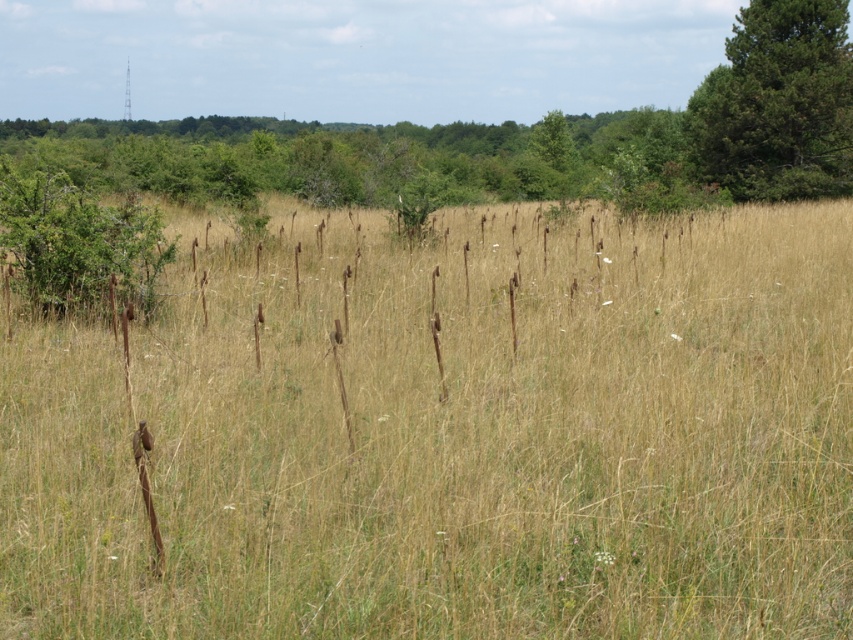
Which is more to the right, dry grass at center or green textured pine tree at upper right?

green textured pine tree at upper right

Find the location of `dry grass at center`. dry grass at center is located at coordinates (450, 435).